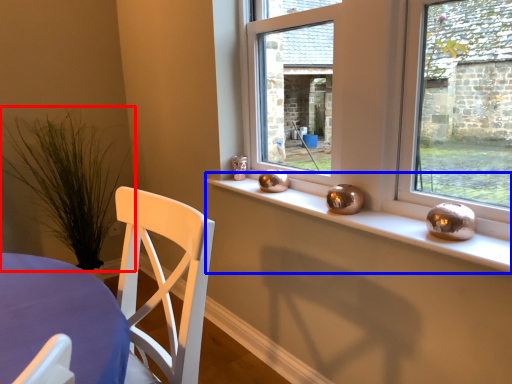
Question: Which point is closer to the camera, plant (highlighted by a red box) or window sill (highlighted by a blue box)?

Choices:
 (A) plant
 (B) window sill

Answer: (B)